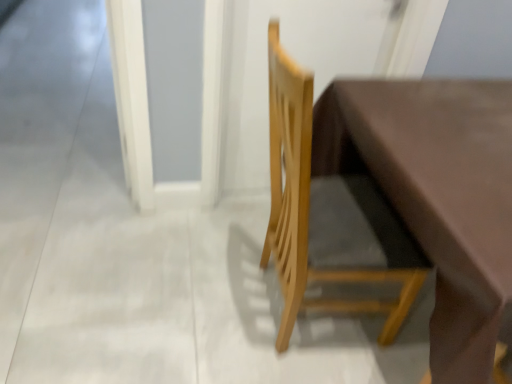
Identify the location of matte brown table at center. (437, 196).

What do you see at coordinates (437, 196) in the screenshot? I see `matte brown table at center` at bounding box center [437, 196].

Measure the distance between point (181, 189) and camera.

They are 1.99 meters apart.

This screenshot has height=384, width=512. I want to click on matte brown table at center, so click(x=437, y=196).

Considering the sizes of objects natural wood chair at center and white glossy screen door at lower left in the image provided, who is taller, natural wood chair at center or white glossy screen door at lower left?

With more height is natural wood chair at center.

From a real-world perspective, relative to white glossy screen door at lower left, is natural wood chair at center vertically above or below?

natural wood chair at center is situated higher than white glossy screen door at lower left in the real world.

From the image's perspective, is natural wood chair at center above or below white glossy screen door at lower left?

Based on their image positions, natural wood chair at center is located beneath white glossy screen door at lower left.

Could you tell me if natural wood chair at center is turned towards white glossy screen door at lower left?

No, natural wood chair at center is not aimed at white glossy screen door at lower left.

What's the angular difference between white glossy screen door at lower left and natural wood chair at center's facing directions?

93.2 degrees separate the facing orientations of white glossy screen door at lower left and natural wood chair at center.

Considering their positions, is white glossy screen door at lower left located in front of or behind natural wood chair at center?

Visually, white glossy screen door at lower left is located behind natural wood chair at center.

Image resolution: width=512 pixels, height=384 pixels. I want to click on screen door that appears above the natural wood chair at center (from the image's perspective), so click(x=148, y=105).

Locate an element on the screen. Image resolution: width=512 pixels, height=384 pixels. table in front of the natural wood chair at center is located at coordinates (437, 196).

Considering the sizes of objects natural wood chair at center and matte brown table at center in the image provided, who is taller, natural wood chair at center or matte brown table at center?

Standing taller between the two is natural wood chair at center.

Is matte brown table at center surrounded by natural wood chair at center?

No, matte brown table at center is not inside natural wood chair at center.

What are the coordinates of `table that is on the right side of white glossy screen door at lower left` in the screenshot? It's located at (437, 196).

Which of these two, matte brown table at center or white glossy screen door at lower left, is bigger?

With larger size is matte brown table at center.

Looking at this image, is matte brown table at center oriented away from white glossy screen door at lower left?

No, matte brown table at center is not facing away from white glossy screen door at lower left.

Can you confirm if matte brown table at center is shorter than white glossy screen door at lower left?

No, matte brown table at center is not shorter than white glossy screen door at lower left.

Is matte brown table at center with natural wood chair at center?

matte brown table at center is not next to natural wood chair at center, and they're not touching.

Is the depth of matte brown table at center greater than that of natural wood chair at center?

No, matte brown table at center is in front of natural wood chair at center.

Does matte brown table at center have a greater width compared to natural wood chair at center?

Yes, matte brown table at center is wider than natural wood chair at center.

This screenshot has width=512, height=384. In order to click on chair that is above the matte brown table at center (from the image's perspective) in this screenshot , I will do `click(328, 215)`.

Considering the sizes of white glossy screen door at lower left and matte brown table at center in the image, is white glossy screen door at lower left wider or thinner than matte brown table at center?

white glossy screen door at lower left is wider than matte brown table at center.

Is white glossy screen door at lower left placed right next to matte brown table at center?

They are not placed beside each other.

Which of these two, white glossy screen door at lower left or matte brown table at center, is bigger?

With larger size is matte brown table at center.

How distant is white glossy screen door at lower left from matte brown table at center?

white glossy screen door at lower left is 79.16 centimeters from matte brown table at center.

Identify the location of chair above the white glossy screen door at lower left (from a real-world perspective). This screenshot has height=384, width=512. pyautogui.click(x=328, y=215).

This screenshot has height=384, width=512. In order to click on chair on the right of white glossy screen door at lower left in this screenshot , I will do `click(328, 215)`.

Looking at the image, which one is located further to natural wood chair at center, matte brown table at center or white glossy screen door at lower left?

white glossy screen door at lower left is further to natural wood chair at center.

Which object lies nearer to the anchor point matte brown table at center, natural wood chair at center or white glossy screen door at lower left?

Based on the image, natural wood chair at center appears to be nearer to matte brown table at center.

Looking at the image, which one is located further to white glossy screen door at lower left, natural wood chair at center or matte brown table at center?

matte brown table at center is further to white glossy screen door at lower left.

Based on their spatial positions, is white glossy screen door at lower left or natural wood chair at center further from matte brown table at center?

white glossy screen door at lower left lies further to matte brown table at center than the other object.

Based on their spatial positions, is white glossy screen door at lower left or matte brown table at center further from natural wood chair at center?

white glossy screen door at lower left is positioned further to the anchor natural wood chair at center.

Estimate the real-world distances between objects in this image. Which object is further from white glossy screen door at lower left, matte brown table at center or natural wood chair at center?

matte brown table at center lies further to white glossy screen door at lower left than the other object.

Where is `chair between white glossy screen door at lower left and matte brown table at center in the horizontal direction`? The height and width of the screenshot is (384, 512). chair between white glossy screen door at lower left and matte brown table at center in the horizontal direction is located at coordinates (328, 215).